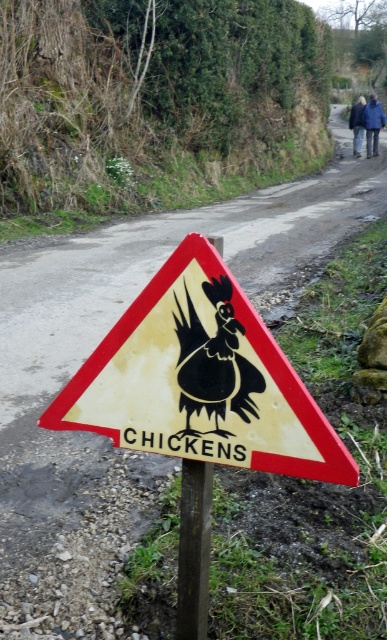
Is point (190, 440) closer to viewer compared to point (178, 618)?

Yes, it is in front of point (178, 618).

Is point (258, 468) farther from viewer compared to point (186, 552)?

No, it is in front of (186, 552).

The width and height of the screenshot is (387, 640). Identify the location of yellow paper sign at center. (200, 380).

Where is `black glossy rooster at center`? black glossy rooster at center is located at coordinates (214, 362).

Can you confirm if black glossy rooster at center is smaller than blue fabric jacket at upper center?

Yes.

Who is more distant from viewer, (243, 413) or (361, 141)?

The point (361, 141) is more distant.

The height and width of the screenshot is (640, 387). I want to click on black glossy rooster at center, so click(214, 362).

Based on the photo, is yellow paper sign at center shorter than blue fabric jacket at upper right?

Indeed, yellow paper sign at center has a lesser height compared to blue fabric jacket at upper right.

Is yellow paper sign at center further to the viewer compared to blue fabric jacket at upper right?

That is False.

Is point (287, 365) farther from camera compared to point (376, 125)?

No, (287, 365) is in front of (376, 125).

Locate an element on the screen. The width and height of the screenshot is (387, 640). yellow paper sign at center is located at coordinates (200, 380).